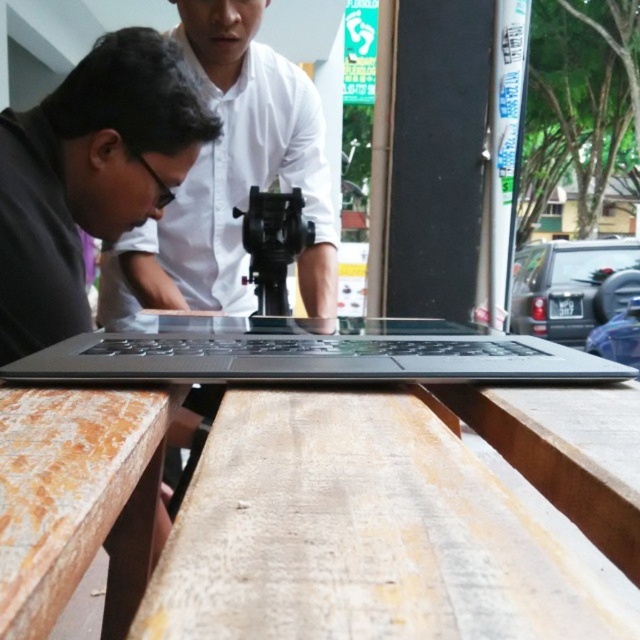
Between point (308, 545) and point (134, 401), which one is positioned behind?

Point (134, 401)

Describe the element at coordinates (358, 532) in the screenshot. Image resolution: width=640 pixels, height=640 pixels. I see `wooden table at center` at that location.

This screenshot has height=640, width=640. In order to click on wooden table at center in this screenshot , I will do `click(358, 532)`.

Does matte black laptop at center have a greater height compared to sleek black laptop at center?

Correct, matte black laptop at center is much taller as sleek black laptop at center.

The width and height of the screenshot is (640, 640). What do you see at coordinates (230, 179) in the screenshot? I see `matte black laptop at center` at bounding box center [230, 179].

Between point (204, 211) and point (417, 371), which one is positioned in front?

Positioned in front is point (417, 371).

Image resolution: width=640 pixels, height=640 pixels. I want to click on matte black laptop at center, so pyautogui.click(x=230, y=179).

Between point (248, 3) and point (4, 492), which one is positioned behind?

Positioned behind is point (248, 3).

Is point (289, 188) farther from viewer compared to point (48, 561)?

Yes.

Locate an element on the screen. This screenshot has height=640, width=640. matte black laptop at center is located at coordinates (230, 179).